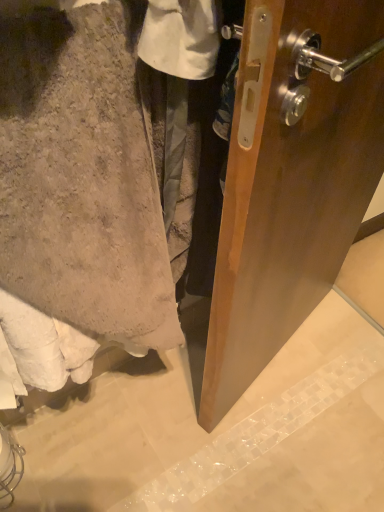
What are the coordinates of `vacant space in beige fuzzy towel at lower left (from a real-world perspective)` in the screenshot? It's located at (122, 406).